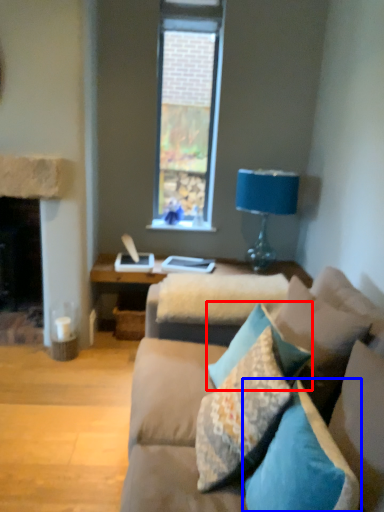
Question: Which object appears closest to the camera in this image, pillow (highlighted by a red box) or pillow (highlighted by a blue box)?

Choices:
 (A) pillow
 (B) pillow

Answer: (B)